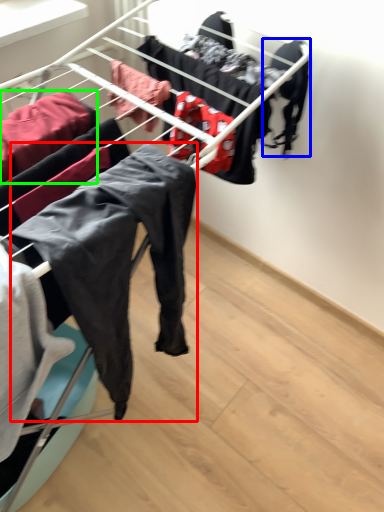
Question: Considering the real-world distances, which object is closest to clothing (highlighted by a red box)? clothing (highlighted by a blue box) or clothing (highlighted by a green box).

Choices:
 (A) clothing
 (B) clothing

Answer: (B)